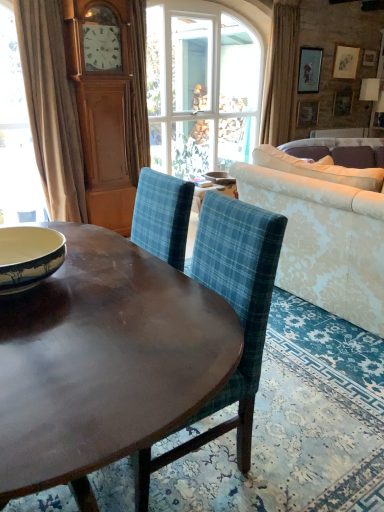
Question: Can you see damask fabric couch at right touching beige fabric curtain at left, the first curtain positioned from the left?

Choices:
 (A) yes
 (B) no

Answer: (B)

Question: Is damask fabric couch at right thinner than beige fabric curtain at left, the first curtain positioned from the left?

Choices:
 (A) yes
 (B) no

Answer: (B)

Question: Is damask fabric couch at right to the right of beige fabric curtain at left, the first curtain positioned from the left, from the viewer's perspective?

Choices:
 (A) yes
 (B) no

Answer: (A)

Question: Is damask fabric couch at right to the left of beige fabric curtain at left, the 1th curtain viewed from the front, from the viewer's perspective?

Choices:
 (A) no
 (B) yes

Answer: (A)

Question: Can you confirm if damask fabric couch at right is bigger than beige fabric curtain at left, the second curtain in the right-to-left sequence?

Choices:
 (A) yes
 (B) no

Answer: (A)

Question: Is damask fabric couch at right further to the viewer compared to beige fabric curtain at left, the 1th curtain viewed from the front?

Choices:
 (A) yes
 (B) no

Answer: (B)

Question: Is shiny brown wood coffee table at center directly adjacent to blue and white ceramic bowl at left, marked as the 2th bowl in a back-to-front arrangement?

Choices:
 (A) no
 (B) yes

Answer: (A)

Question: From the image's perspective, is shiny brown wood coffee table at center located above blue and white ceramic bowl at left, which ranks as the 1th bowl in bottom-to-top order?

Choices:
 (A) no
 (B) yes

Answer: (A)

Question: Considering the relative positions of shiny brown wood coffee table at center and blue and white ceramic bowl at left, the first bowl viewed from the left, in the image provided, is shiny brown wood coffee table at center to the left of blue and white ceramic bowl at left, the first bowl viewed from the left, from the viewer's perspective?

Choices:
 (A) no
 (B) yes

Answer: (A)

Question: Would you say shiny brown wood coffee table at center is a long distance from blue and white ceramic bowl at left, the first bowl viewed from the left?

Choices:
 (A) yes
 (B) no

Answer: (B)

Question: Is shiny brown wood coffee table at center completely or partially outside of blue and white ceramic bowl at left, which ranks as the 1th bowl in bottom-to-top order?

Choices:
 (A) no
 (B) yes

Answer: (B)

Question: Is the position of shiny brown wood coffee table at center more distant than that of blue and white ceramic bowl at left, which ranks as the 1th bowl in bottom-to-top order?

Choices:
 (A) no
 (B) yes

Answer: (A)

Question: Considering the relative sizes of beige fabric curtain at left, the second curtain in the right-to-left sequence, and shiny brown wood coffee table at center in the image provided, is beige fabric curtain at left, the second curtain in the right-to-left sequence, thinner than shiny brown wood coffee table at center?

Choices:
 (A) no
 (B) yes

Answer: (B)